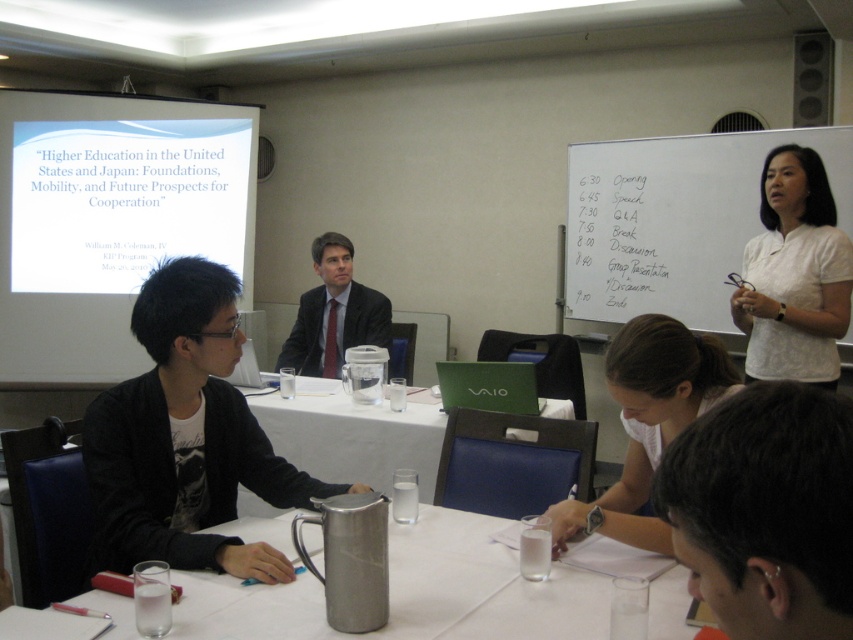
Is white matte projection screen at upper left shorter than white cotton shirt at upper right?

Incorrect, white matte projection screen at upper left's height does not fall short of white cotton shirt at upper right's.

This screenshot has width=853, height=640. What do you see at coordinates (109, 220) in the screenshot?
I see `white matte projection screen at upper left` at bounding box center [109, 220].

Is point (229, 196) closer to viewer compared to point (791, 148)?

No, (229, 196) is further to viewer.

Identify the location of white matte projection screen at upper left. The width and height of the screenshot is (853, 640). (109, 220).

Who is lower down, silver metallic pitcher at center or white cotton shirt at upper right?

silver metallic pitcher at center is below.

Does point (596, 636) come closer to viewer compared to point (747, 289)?

Yes, it is in front of point (747, 289).

Image resolution: width=853 pixels, height=640 pixels. Find the location of `silver metallic pitcher at center`. silver metallic pitcher at center is located at coordinates (412, 593).

Which is below, white matte projection screen at upper left or dark hair at lower right?

Positioned lower is dark hair at lower right.

The height and width of the screenshot is (640, 853). What do you see at coordinates (109, 220) in the screenshot?
I see `white matte projection screen at upper left` at bounding box center [109, 220].

Identify the location of white matte projection screen at upper left. (109, 220).